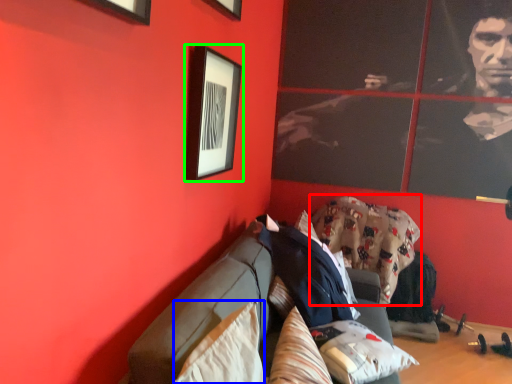
Question: Considering the real-world distances, which object is closest to blanket (highlighted by a red box)? pillow (highlighted by a blue box) or picture frame (highlighted by a green box).

Choices:
 (A) pillow
 (B) picture frame

Answer: (B)